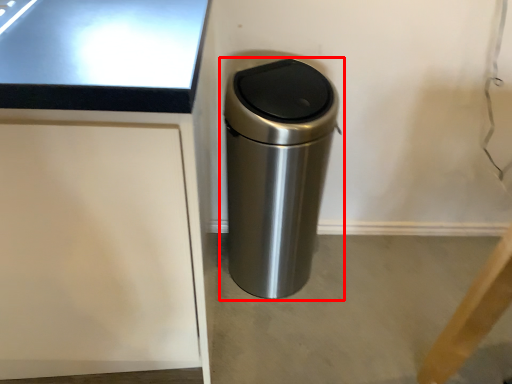
Question: From the image's perspective, where is waste container (annotated by the red box) located in relation to concrete in the image?

Choices:
 (A) below
 (B) above

Answer: (B)